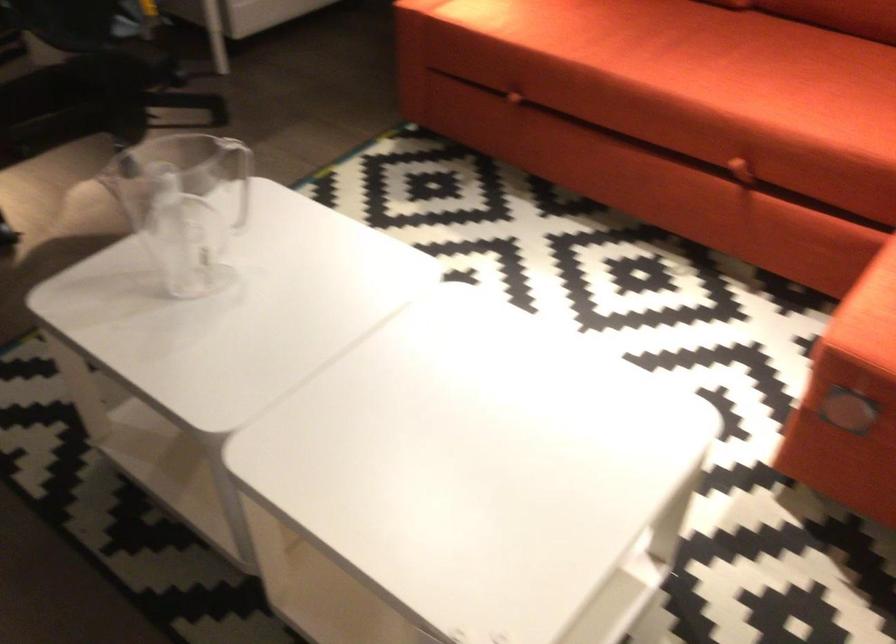
The width and height of the screenshot is (896, 644). In order to click on clear pitcher handle in this screenshot , I will do `click(238, 176)`.